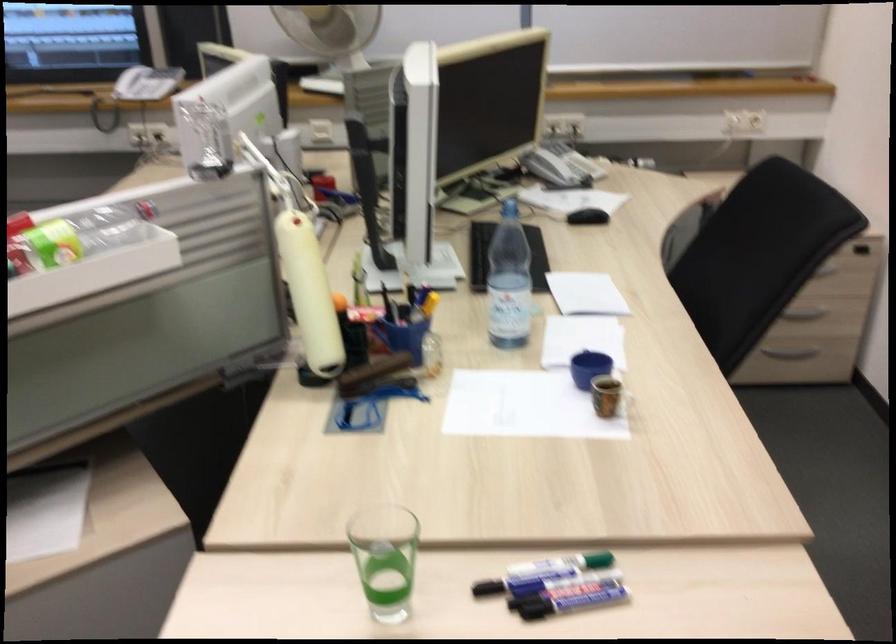
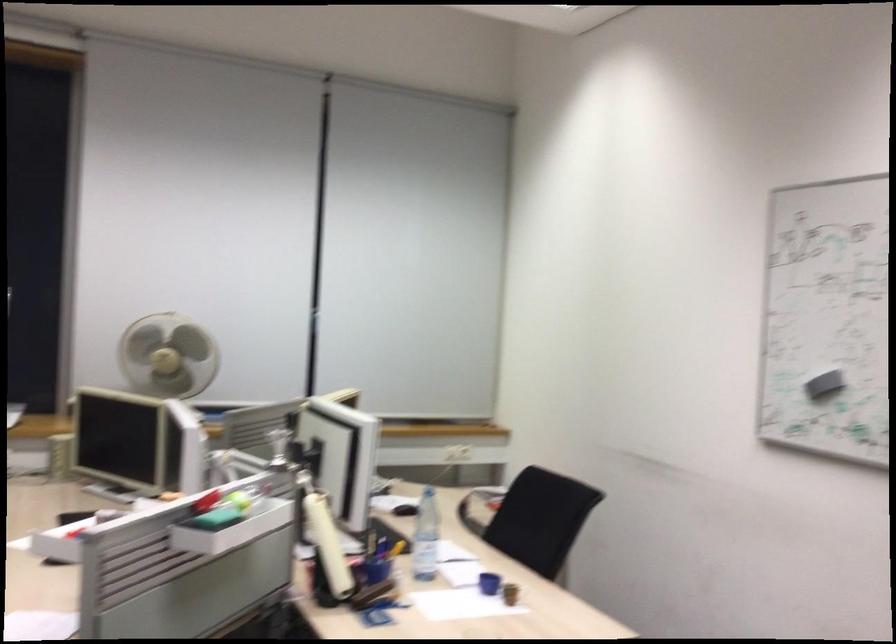
Where in the second image is the point corresponding to the point at 606,412 from the first image?

(510, 592)